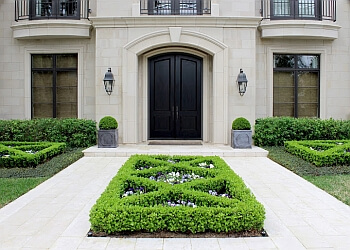
Where is `door way`? This screenshot has width=350, height=250. door way is located at coordinates (178, 50).